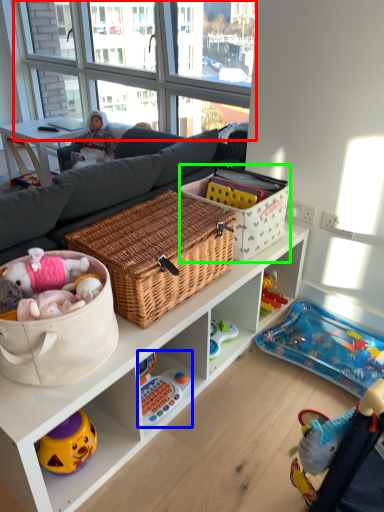
Question: Which is farther away from window screen (highlighted by a red box)? toy (highlighted by a blue box) or storage box (highlighted by a green box)?

Choices:
 (A) toy
 (B) storage box

Answer: (A)